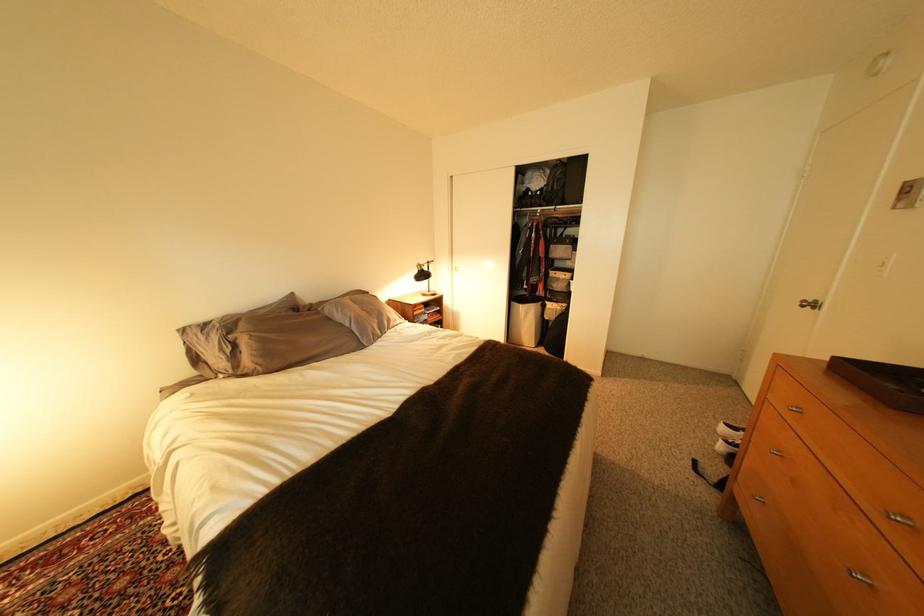
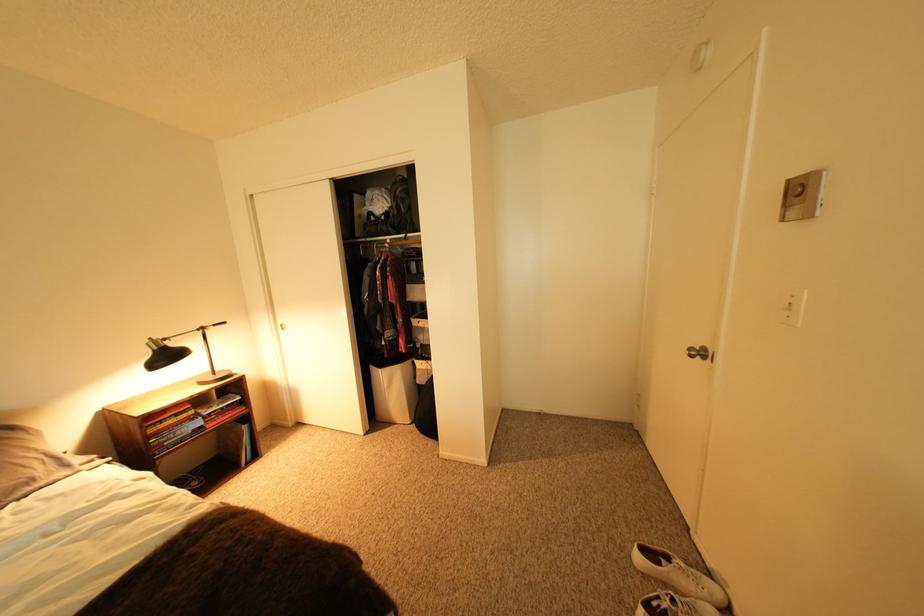
Where in the second image is the point corresponding to point 736,431 from the first image?

(651, 560)